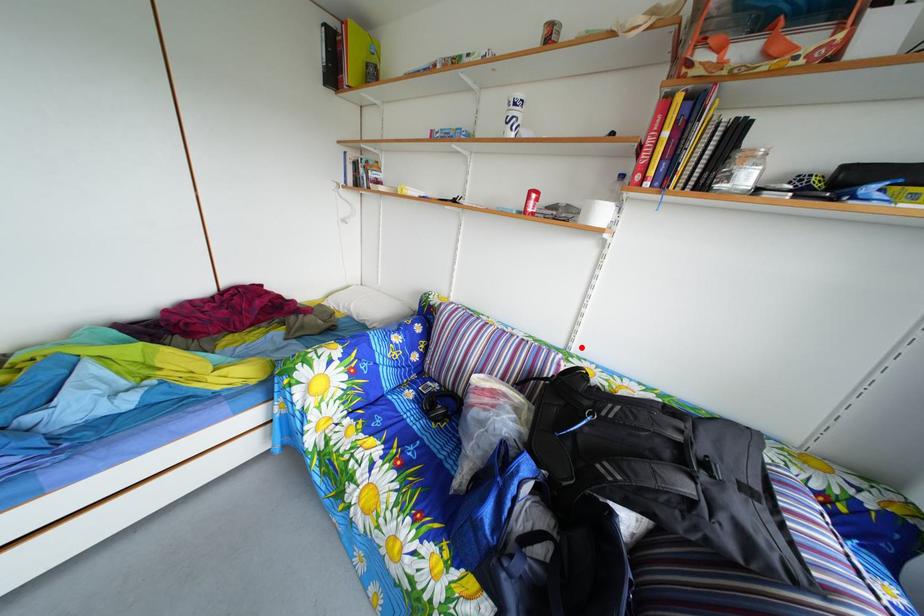
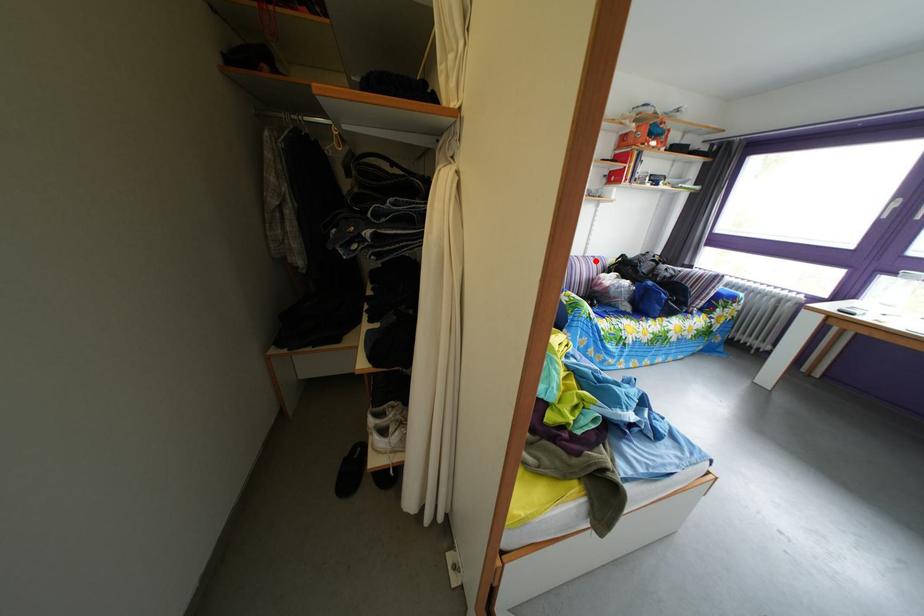
I am providing you with two images of the same scene from different viewpoints. A red point is marked on the first image and another point is marked on the second image. Are the points marked in image1 and image2 representing the same 3D position?

Yes